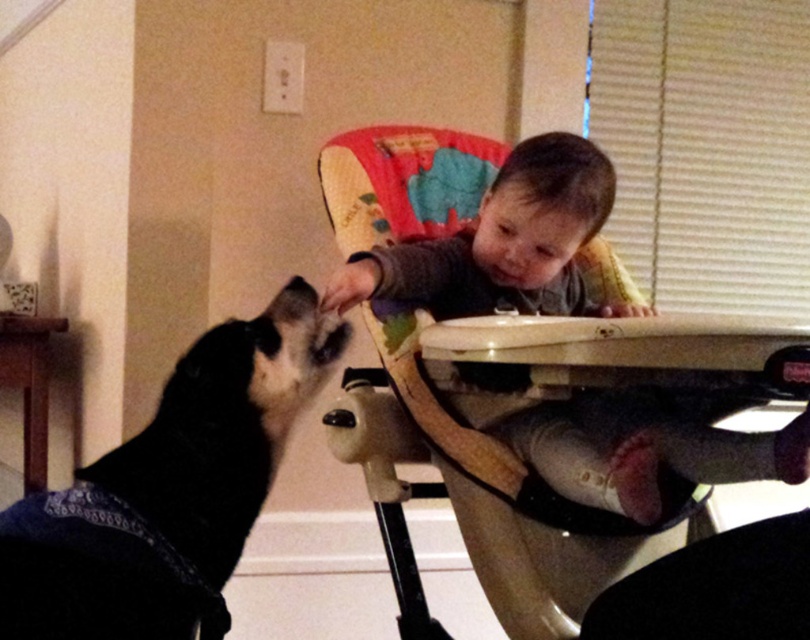
You are a delivery person entering the room and need to place a package between the beige plastic high chair at center and the black fabric dog at left. Which object should you move closer to you to create space?

Since the beige plastic high chair at center is further to the viewer than the black fabric dog at left, you should move the black fabric dog at left closer to you to create space between them.

You are a delivery robot that needs to place a small package at point (505, 218). The robot is 2 feet wide. Will the robot be able to reach that point without moving any objects?

The distance between point (505, 218) and the camera is 4.43 feet. Since the robot is 2 feet wide, it can navigate to the point as long as there are no obstacles blocking the path. However, the description does not mention any obstacles, so it should be possible.